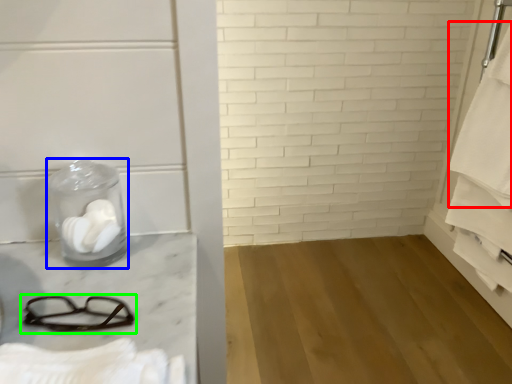
Question: Based on their relative distances, which object is nearer to bath towel (highlighted by a red box)? Choose from glass jar (highlighted by a blue box) and glasses (highlighted by a green box).

Choices:
 (A) glass jar
 (B) glasses

Answer: (A)